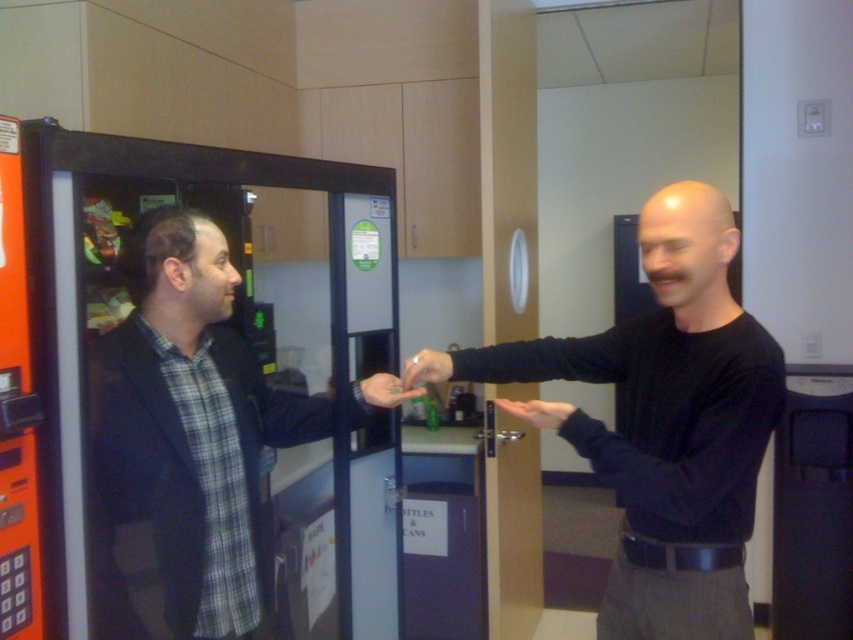
Between smooth skin hand at center and matte plastic hand at center, which one is positioned higher?

Positioned higher is matte plastic hand at center.

Can you confirm if smooth skin hand at center is positioned below matte plastic hand at center?

Indeed, smooth skin hand at center is positioned under matte plastic hand at center.

Which is behind, point (560, 420) or point (405, 385)?

The point (405, 385) is behind.

Locate an element on the screen. Image resolution: width=853 pixels, height=640 pixels. smooth skin hand at center is located at coordinates (537, 412).

Can you confirm if matte plastic hand at center is thinner than matte black hand at center?

Yes, matte plastic hand at center is thinner than matte black hand at center.

Describe the element at coordinates (426, 369) in the screenshot. I see `matte plastic hand at center` at that location.

Who is more forward, (410, 365) or (386, 388)?

Point (410, 365) is in front.

Where is `matte plastic hand at center`? matte plastic hand at center is located at coordinates (426, 369).

Can you confirm if plaid shirt at left is positioned to the right of matte black hand at center?

No, plaid shirt at left is not to the right of matte black hand at center.

Can you confirm if plaid shirt at left is smaller than matte black hand at center?

Actually, plaid shirt at left might be larger than matte black hand at center.

Who is more distant from viewer, (254,528) or (399,394)?

The point (254,528) is more distant.

At what (x,y) coordinates should I click in order to perform the action: click on plaid shirt at left. Please return your answer as a coordinate pair (x, y). This screenshot has height=640, width=853. Looking at the image, I should click on (190, 424).